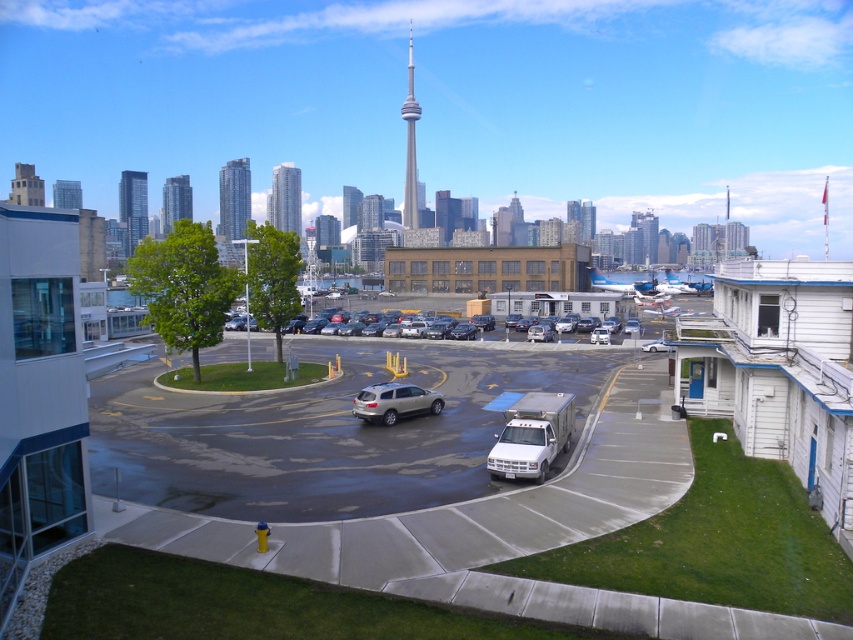
Question: Which of the following is the farthest from the observer?

Choices:
 (A) glassy reflective skyscraper at left
 (B) matte gray tower at upper left
 (C) gray concrete building at upper left
 (D) concrete parking lot at center

Answer: (C)

Question: Is silver glass skyscraper at center smaller than gray concrete building at upper left?

Choices:
 (A) yes
 (B) no

Answer: (A)

Question: Which of the following is the closest to the observer?

Choices:
 (A) glassy reflective skyscraper at upper left
 (B) matte gray tower at upper left

Answer: (B)

Question: Among these points, which one is farthest from the camera?

Choices:
 (A) (352, 198)
 (B) (216, 476)
 (C) (291, 227)

Answer: (C)

Question: Is glassy reflective skyscraper at upper left above matte gray tower at upper left?

Choices:
 (A) no
 (B) yes

Answer: (A)

Question: Is silver glass skyscraper at upper left wider than white smooth cn tower at center?

Choices:
 (A) no
 (B) yes

Answer: (B)